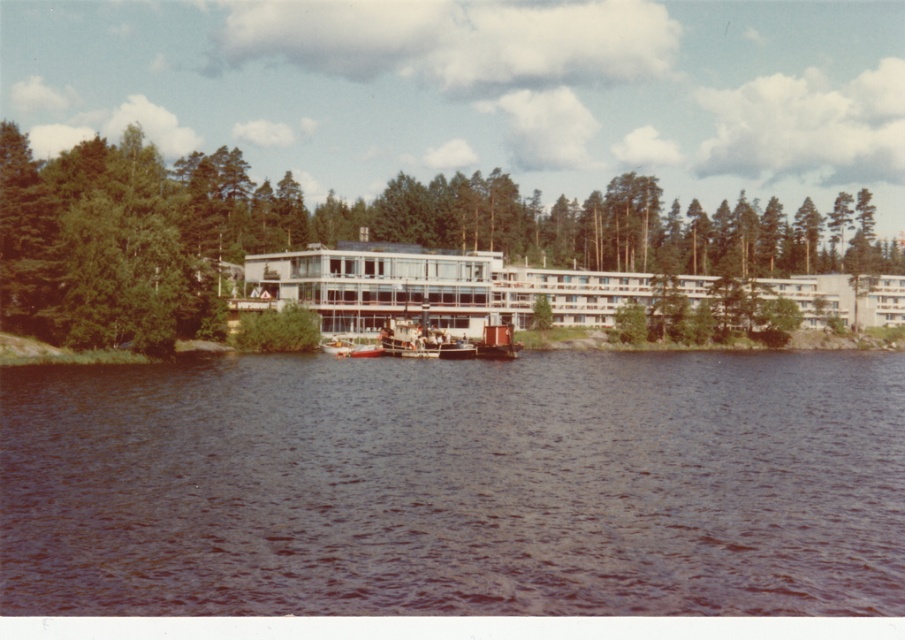
Question: Is matte glass building at center to the right of wooden boat at center from the viewer's perspective?

Choices:
 (A) no
 (B) yes

Answer: (B)

Question: Which of the following is the closest to the observer?

Choices:
 (A) wooden boat at center
 (B) green leafy tree at center
 (C) brown water at center

Answer: (C)

Question: Which point appears farthest from the camera in this image?

Choices:
 (A) click(x=267, y=236)
 (B) click(x=337, y=294)
 (C) click(x=493, y=326)
 (D) click(x=777, y=460)

Answer: (A)

Question: Is brown water at center positioned before green leafy tree at center?

Choices:
 (A) yes
 (B) no

Answer: (A)

Question: Which point is closer to the camera?

Choices:
 (A) matte glass building at center
 (B) wooden boat at center
 (C) brown water at center
 (D) green leafy tree at center

Answer: (C)

Question: Where is green leafy tree at center located in relation to matte glass building at center in the image?

Choices:
 (A) right
 (B) left

Answer: (B)